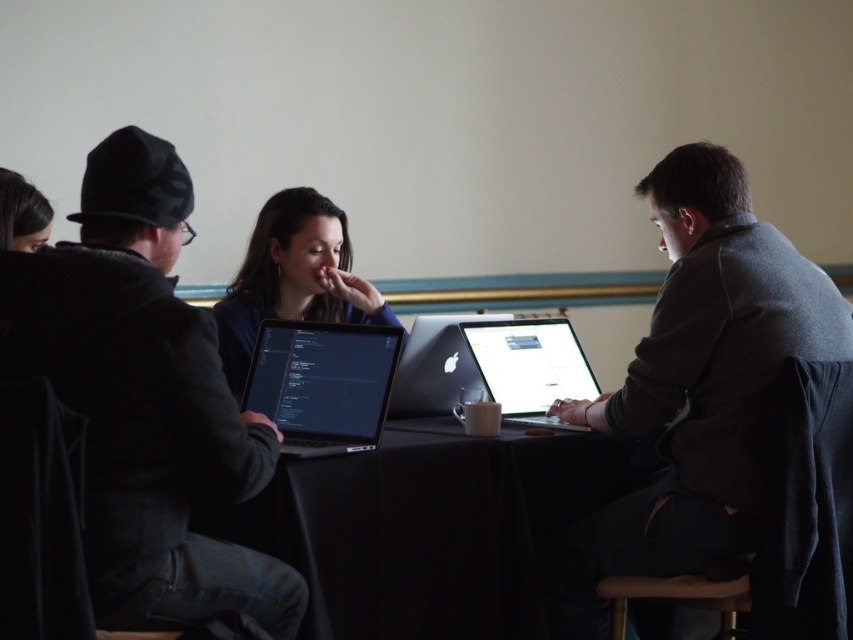
Question: Can you confirm if satin silver laptop at center is positioned above wooden at lower center?

Choices:
 (A) yes
 (B) no

Answer: (A)

Question: Considering the relative positions of silver metallic laptop at center and wooden at lower center in the image provided, where is silver metallic laptop at center located with respect to wooden at lower center?

Choices:
 (A) below
 (B) above

Answer: (B)

Question: Which is farther from the black fabric table at center?

Choices:
 (A) shiny black laptop at center
 (B) smooth brown hair at upper left
 (C) wooden at lower center
 (D) matte black laptop at center

Answer: (B)

Question: Is shiny black laptop at center closer to the viewer compared to satin silver laptop at center?

Choices:
 (A) no
 (B) yes

Answer: (B)

Question: Which object appears closest to the camera in this image?

Choices:
 (A) satin silver laptop at center
 (B) smooth brown hair at upper left

Answer: (B)

Question: Which point is closer to the camera?

Choices:
 (A) (427, 332)
 (B) (270, 449)
 (C) (553, 381)

Answer: (B)